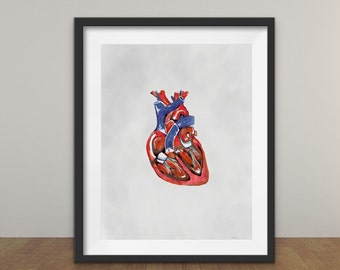
Locate an element on the screen. This screenshot has height=270, width=340. wall is located at coordinates coord(312,142), coord(20,179).